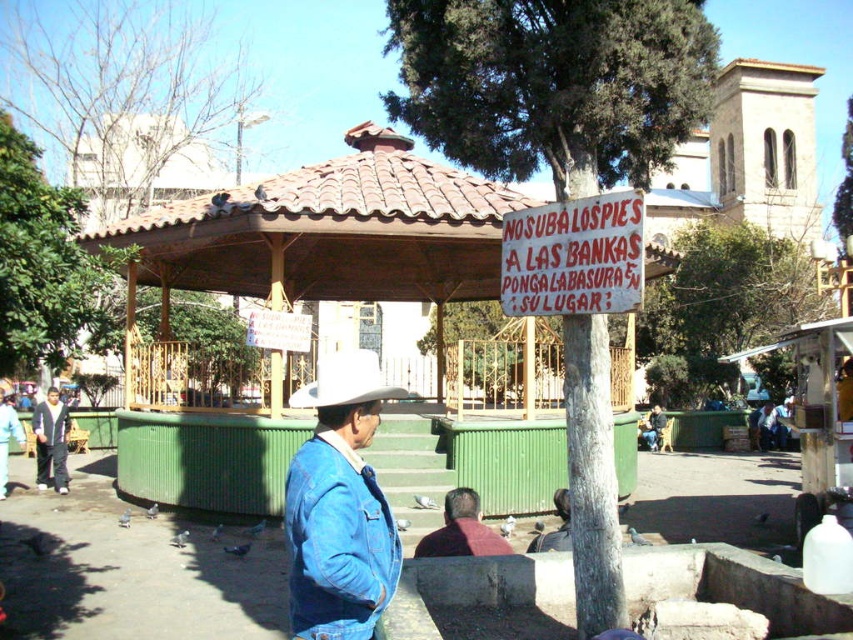
Question: Which point is farther to the camera?

Choices:
 (A) blue denim jacket at center
 (B) dark red sweater at lower center
 (C) white felt cowboy hat at center

Answer: (B)

Question: Which point is closer to the camera?

Choices:
 (A) blue denim jacket at center
 (B) white felt cowboy hat at center
 (C) denim jacket at left

Answer: (A)

Question: Which object is positioned farthest from the white felt cowboy hat at center?

Choices:
 (A) denim jacket at left
 (B) white painted wood sign at center

Answer: (A)

Question: Does blue denim jacket at center appear on the left side of dark red sweater at lower center?

Choices:
 (A) no
 (B) yes

Answer: (B)

Question: Is blue denim jacket at center thinner than white felt cowboy hat at center?

Choices:
 (A) no
 (B) yes

Answer: (B)

Question: Is white felt cowboy hat at center smaller than denim jacket at left?

Choices:
 (A) yes
 (B) no

Answer: (B)